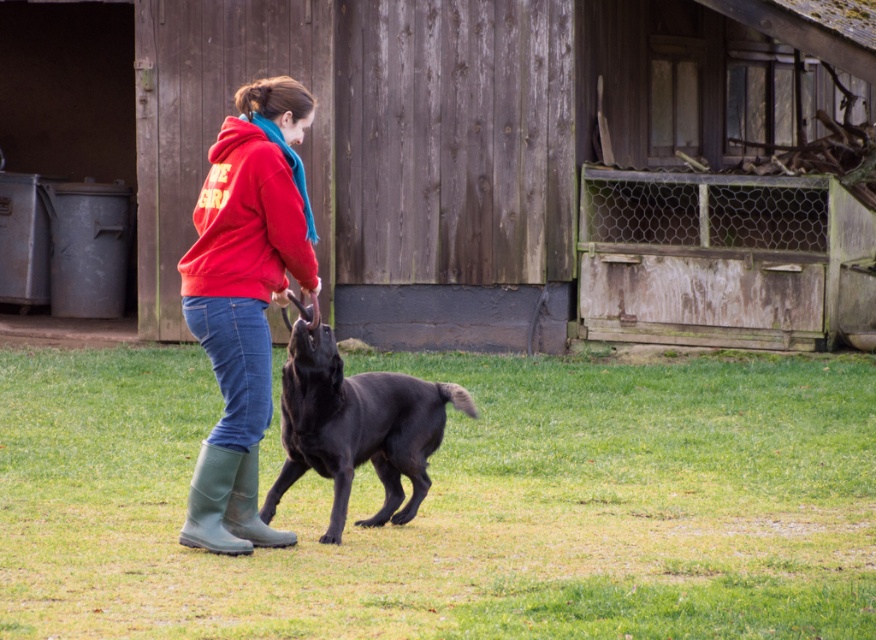
Question: Does shiny black dog at center appear on the right side of green rubber boot at lower left?

Choices:
 (A) no
 (B) yes

Answer: (B)

Question: Which object is the closest to the weathered wood barn at center?

Choices:
 (A) green rubber boot at lower center
 (B) green rubber boot at lower left
 (C) black rubber boots at lower left

Answer: (C)

Question: Which point is closer to the camera?

Choices:
 (A) (203, 465)
 (B) (39, 589)

Answer: (B)

Question: Where is red fleece sweatshirt at center located in relation to green rubber boot at lower left in the image?

Choices:
 (A) left
 (B) right

Answer: (B)

Question: Which point appears farthest from the camera in this image?

Choices:
 (A) (263, 513)
 (B) (224, 364)

Answer: (A)

Question: Does weathered wood barn at center appear under matte red hoodie at center?

Choices:
 (A) no
 (B) yes

Answer: (B)